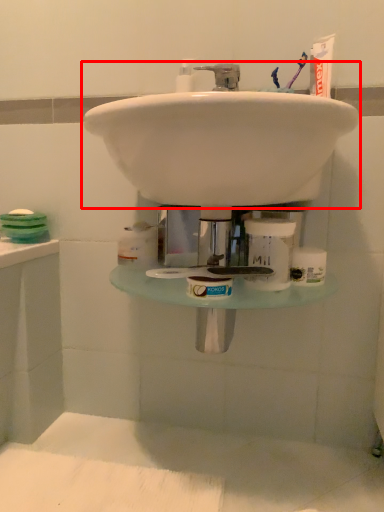
Question: From the image's perspective, where is sink (annotated by the red box) located relative to toiletry?

Choices:
 (A) above
 (B) below

Answer: (A)